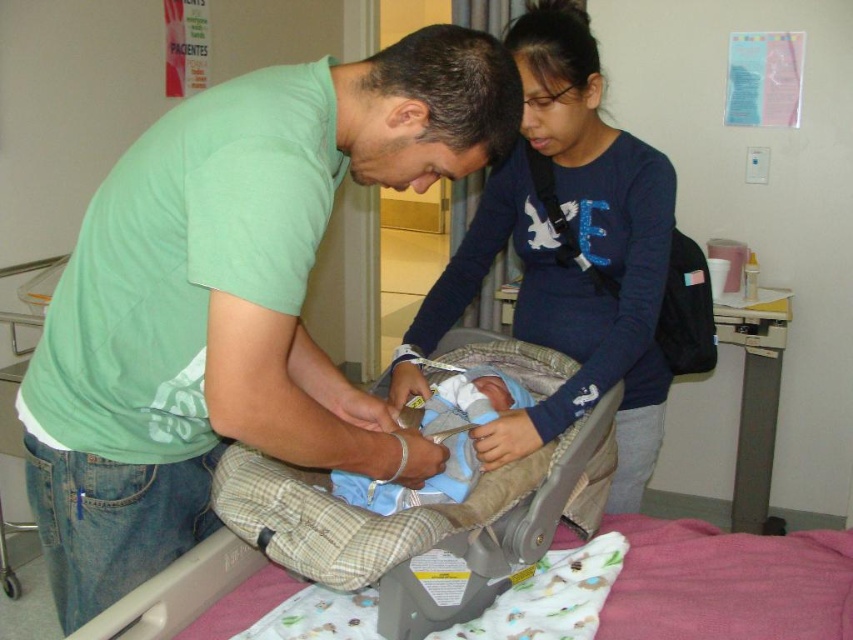
Based on the coordinates provided, which object is located at point (231, 300) in the hospital scene?

The point (231, 300) corresponds to the green cotton shirt at center.